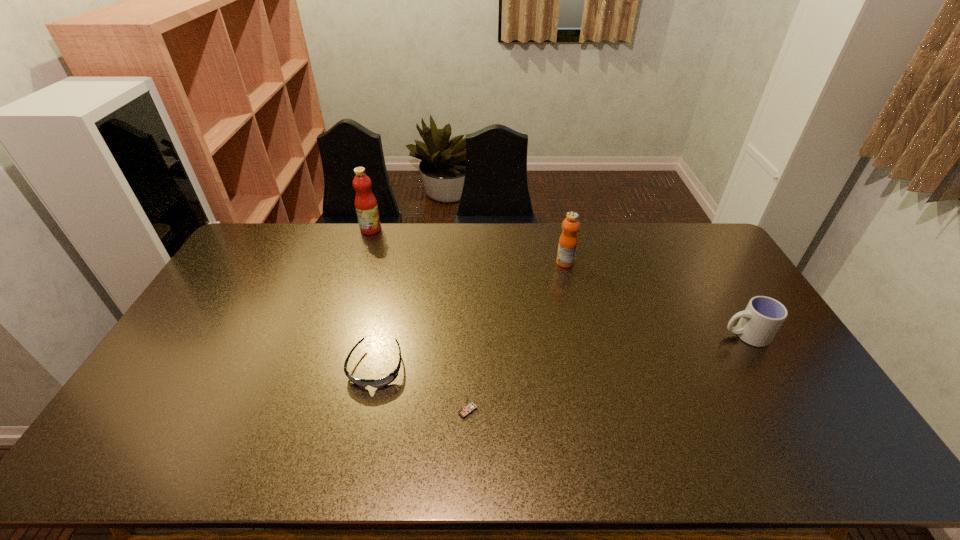
Where is `the tallest object`? the tallest object is located at coordinates [x=366, y=206].

This screenshot has height=540, width=960. What are the coordinates of `the leftmost object` in the screenshot? It's located at pos(366,206).

The width and height of the screenshot is (960, 540). Identify the location of the right fruit juice. (567, 246).

Identify the location of the shorter fruit juice. (567, 246).

Where is `cup`? This screenshot has height=540, width=960. cup is located at coordinates (760, 321).

The width and height of the screenshot is (960, 540). I want to click on the third shortest object, so click(760, 321).

Find the location of `the third object from right to left`. the third object from right to left is located at coordinates (469, 407).

Find the location of a particular element. Image resolution: width=960 pixels, height=540 pixels. the second shortest object is located at coordinates (469, 407).

Locate an element on the screen. The width and height of the screenshot is (960, 540). the shortest object is located at coordinates (382, 382).

The image size is (960, 540). What are the coordinates of `the second object from left to right` in the screenshot? It's located at (382, 382).